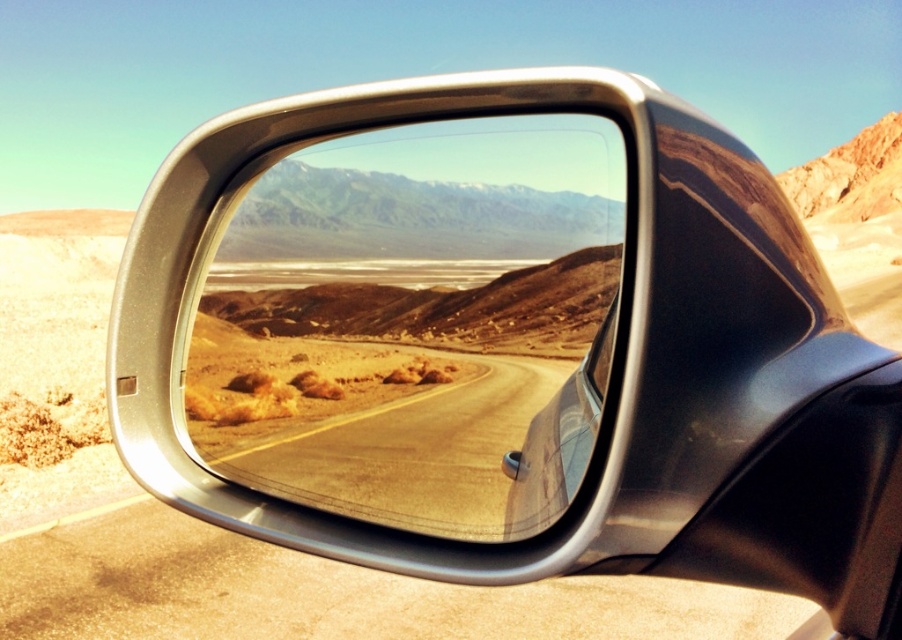
Which is in front, point (383, 224) or point (269, 371)?

Point (383, 224) is in front.

Find the location of a particular element. satin chrome mirror at center is located at coordinates (417, 323).